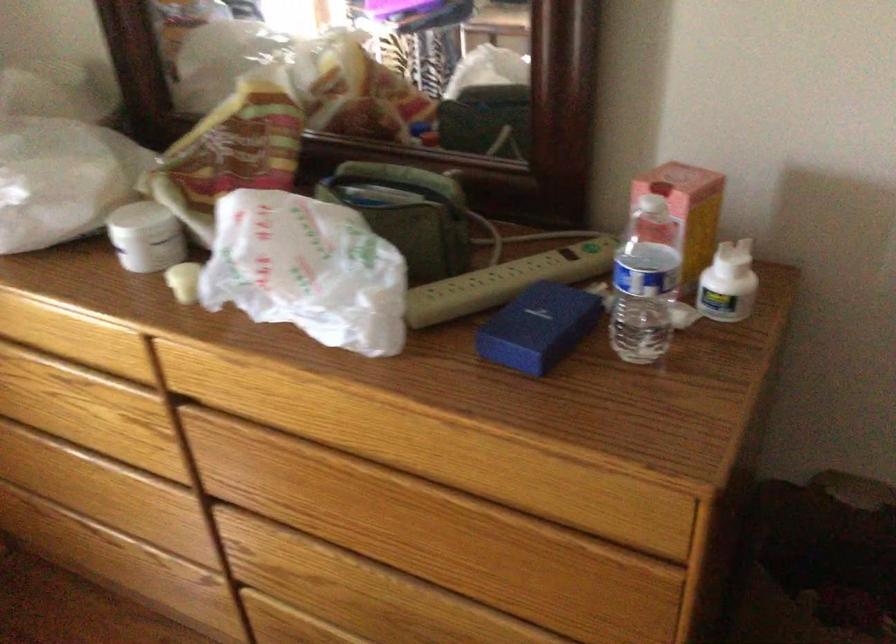
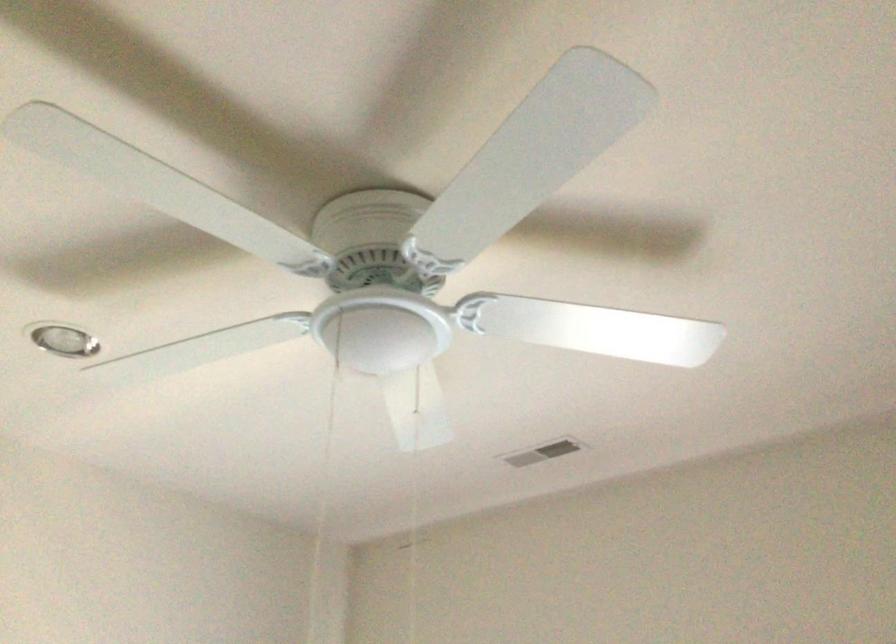
In the scene shown: First-person continuous shooting, in which direction is the camera rotating?

The camera's rotation is toward left-up.